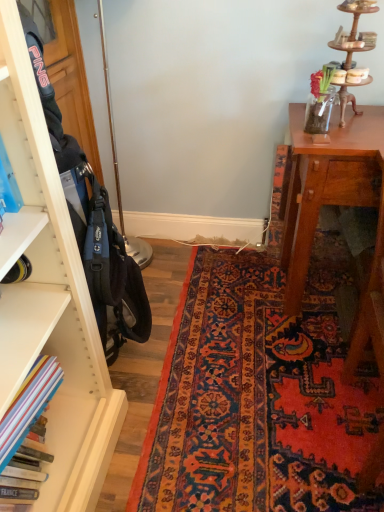
Identify the location of hardcover books at left. (28, 405).

Describe the element at coordinates (28, 405) in the screenshot. I see `hardcover books at left` at that location.

What do you see at coordinates (259, 395) in the screenshot? I see `carpet with intricate patterns at center` at bounding box center [259, 395].

Find the location of a particular element. The image size is (384, 512). carpet with intricate patterns at center is located at coordinates (259, 395).

Where is `hardcover books at left`? This screenshot has height=512, width=384. hardcover books at left is located at coordinates (28, 405).

Is hardcover books at left to the right of carpet with intricate patterns at center from the viewer's perspective?

In fact, hardcover books at left is to the left of carpet with intricate patterns at center.

Consider the image. Considering the relative positions of hardcover books at left and carpet with intricate patterns at center in the image provided, is hardcover books at left behind carpet with intricate patterns at center?

No, hardcover books at left is in front of carpet with intricate patterns at center.

Which point is more forward, (40, 395) or (270, 454)?

The point (40, 395) is in front.

From the image's perspective, is hardcover books at left above carpet with intricate patterns at center?

No, from the image's perspective, hardcover books at left is not over carpet with intricate patterns at center.

Based on the photo, from a real-world perspective, is hardcover books at left above or below carpet with intricate patterns at center?

hardcover books at left is situated higher than carpet with intricate patterns at center in the real world.

Does hardcover books at left have a lesser width compared to carpet with intricate patterns at center?

Indeed, hardcover books at left has a lesser width compared to carpet with intricate patterns at center.

Between hardcover books at left and carpet with intricate patterns at center, which one has more height?

Standing taller between the two is hardcover books at left.

Considering the relative sizes of hardcover books at left and carpet with intricate patterns at center in the image provided, is hardcover books at left smaller than carpet with intricate patterns at center?

Indeed, hardcover books at left has a smaller size compared to carpet with intricate patterns at center.

Is carpet with intricate patterns at center completely or partially inside hardcover books at left?

Actually, carpet with intricate patterns at center is outside hardcover books at left.

Looking at this image, is hardcover books at left not near carpet with intricate patterns at center?

They are positioned close to each other.

Is hardcover books at left looking in the opposite direction of carpet with intricate patterns at center?

That's not correct — hardcover books at left is not looking away from carpet with intricate patterns at center.

The image size is (384, 512). I want to click on mat located behind the hardcover books at left, so click(259, 395).

Which is more to the left, carpet with intricate patterns at center or hardcover books at left?

From the viewer's perspective, hardcover books at left appears more on the left side.

Is carpet with intricate patterns at center positioned in front of hardcover books at left?

That is False.

Which is closer, (267, 293) or (6, 465)?

The point (6, 465) is closer.

From the image's perspective, is carpet with intricate patterns at center below hardcover books at left?

Actually, carpet with intricate patterns at center appears above hardcover books at left in the image.

From a real-world perspective, which object rests below the other?

carpet with intricate patterns at center, from a real-world perspective.

Between carpet with intricate patterns at center and hardcover books at left, which one has smaller width?

hardcover books at left is thinner.

In the scene shown: Is carpet with intricate patterns at center taller or shorter than hardcover books at left?

Considering their sizes, carpet with intricate patterns at center has less height than hardcover books at left.

Between carpet with intricate patterns at center and hardcover books at left, which one has smaller size?

hardcover books at left is smaller.

Is carpet with intricate patterns at center located outside hardcover books at left?

Yes, carpet with intricate patterns at center is not within hardcover books at left.

Is carpet with intricate patterns at center next to hardcover books at left and touching it?

There is a gap between carpet with intricate patterns at center and hardcover books at left.

Is carpet with intricate patterns at center facing away from hardcover books at left?

No, carpet with intricate patterns at center's orientation is not away from hardcover books at left.

From the picture: What's the angular difference between carpet with intricate patterns at center and hardcover books at left's facing directions?

A: The facing directions of carpet with intricate patterns at center and hardcover books at left are 95.7 degrees apart.

Measure the distance from carpet with intricate patterns at center to hardcover books at left.

The distance of carpet with intricate patterns at center from hardcover books at left is 26.09 inches.

The height and width of the screenshot is (512, 384). Find the location of `mat on the right of hardcover books at left`. mat on the right of hardcover books at left is located at coordinates (259, 395).

Locate an element on the screen. mat located above the hardcover books at left (from the image's perspective) is located at coordinates (259, 395).

Locate an element on the screen. This screenshot has height=512, width=384. mat behind the hardcover books at left is located at coordinates (259, 395).